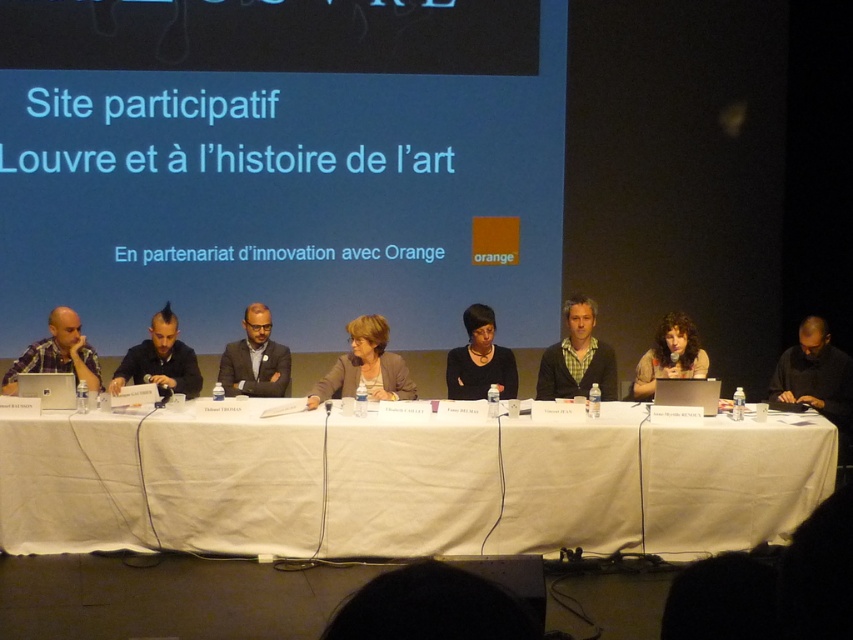
You are a photographer taking a group photo of the panelists. You notice the checkered fabric shirt at center and the curly hair at center. Which object should you adjust to ensure the entire shirt and hair are visible in the frame?

The checkered fabric shirt at center might be wider than curly hair at center, so you should adjust the checkered fabric shirt at center to ensure it fits within the frame.

What is the exact coordinate of the black matte shirt at center?

The black matte shirt at center is located at point (815, 374).

What is the relationship in size between the black matte shirt at center and the curly hair at center?

The black matte shirt at center is bigger than curly hair at center.